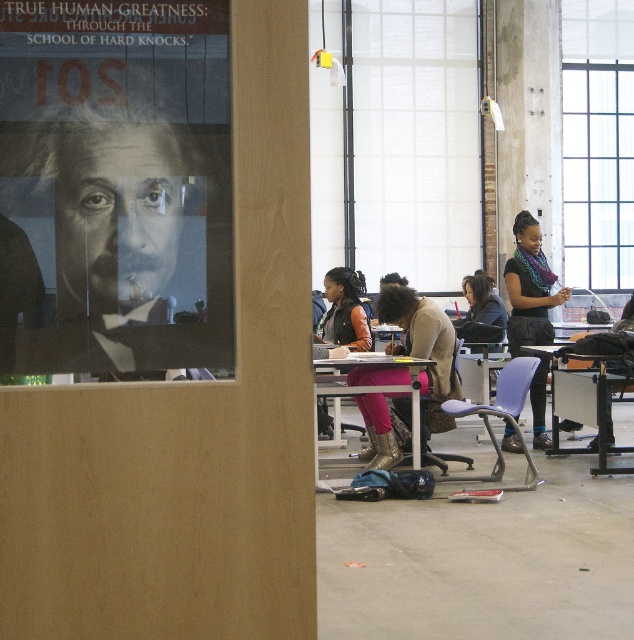
You are a student entering the classroom through the door. You see the metallic silver table at center and the purple plastic chair at lower center. Which object is closer to you as you enter?

The purple plastic chair at lower center is behind the metallic silver table at center, so the metallic silver table at center is closer to you as you enter the classroom.

You are a student entering the classroom through the partially open wooden door. You need to place your orange leather jacket at center on the metallic silver table at center. Can you confirm if the jacket will fit on the table?

The metallic silver table at center might be wider than orange leather jacket at center, so there is a possibility that the jacket will fit on the table.

You are a student entering the classroom through the partially open wooden door. You need to sit down at the purple plastic chair at lower center. Based on the coordinates provided, can you estimate how far to the right and down from the door edge you should move to reach the chair?

The purple plastic chair at lower center is located at coordinates point (x=501, y=417). This means it is 65.2 percent to the right and 79.2 percent downward from the door edge, so you should move right and down accordingly to reach it.